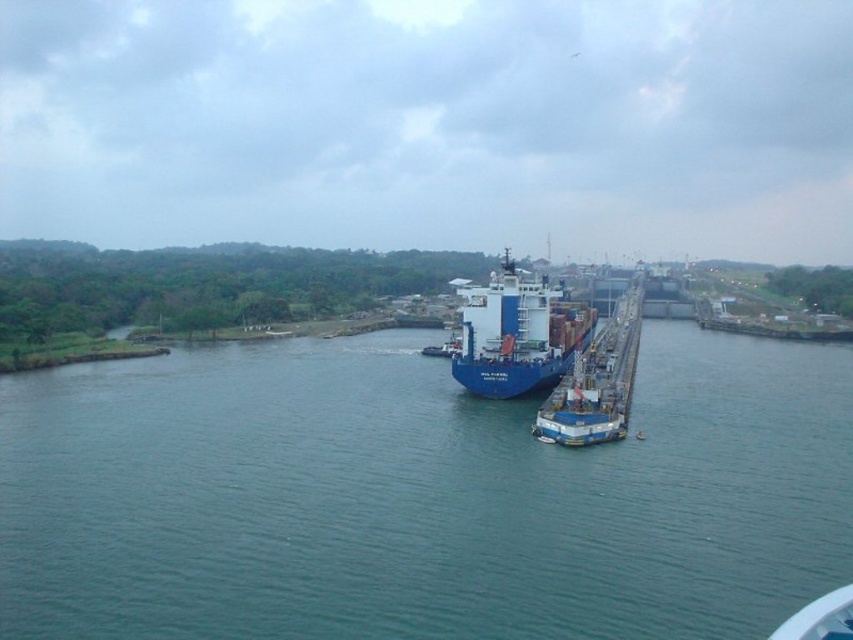
You are standing on the edge of the Panama Canal and see a point marked at coordinates point (642,497). If you want to throw a stone to hit that point, and your maximum throwing distance is 150 feet, will you be able to reach it?

The point (642,497) is 152.66 feet away from the viewer. Since your maximum throwing distance is 150 feet, you cannot reach it.

You are a drone operator tasked with capturing aerial footage of the blue metallic water at center and the blue matte container ship at center. From the perspective of the drone, which object is positioned lower?

The blue metallic water at center is located below the blue matte container ship at center, so the blue metallic water at center is positioned lower.